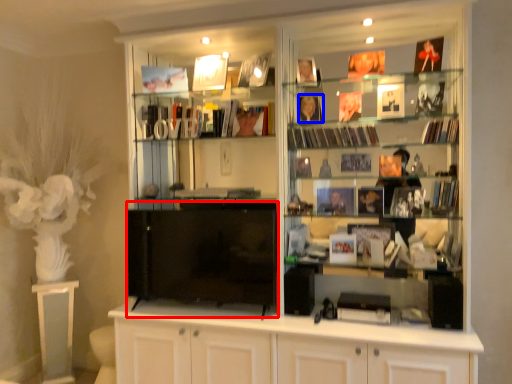
Question: Which point is closer to the camera, wide (highlighted by a red box) or book (highlighted by a blue box)?

Choices:
 (A) wide
 (B) book

Answer: (A)